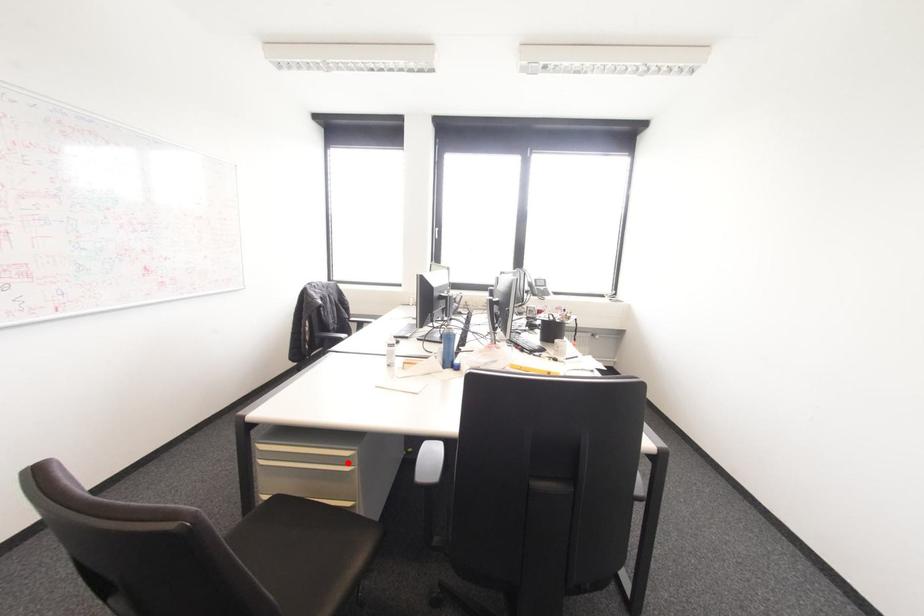
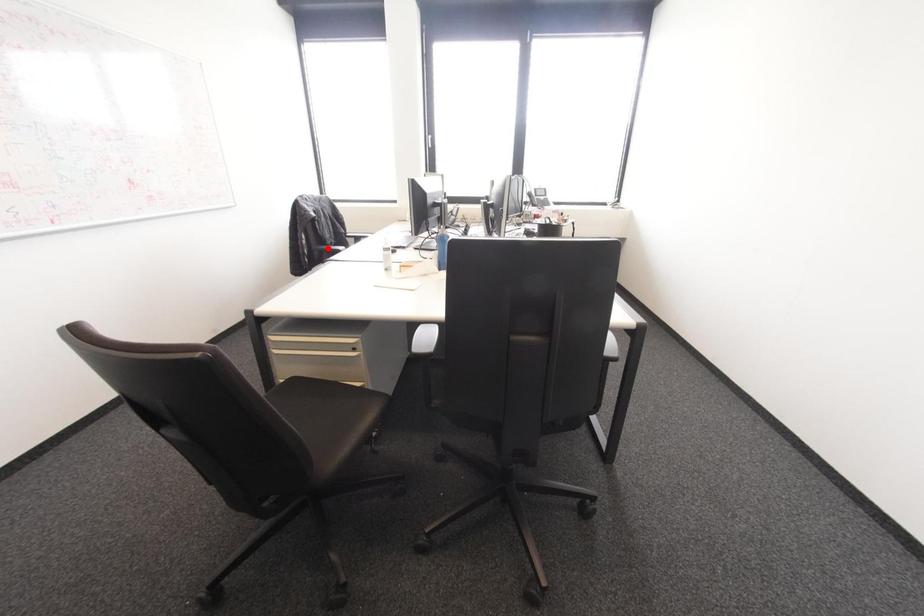
I am providing you with two images of the same scene from different viewpoints. A red point is marked on the first image and another point is marked on the second image. Does the point marked in image1 correspond to the same location as the one in image2?

No